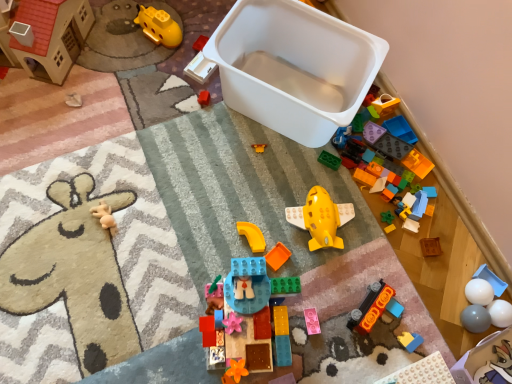
You are a GUI agent. You are given a task and a screenshot of the screen. Output one action in this format:
    pyautogui.click(x=<x>, y=<y>)
    Task: Click on the vacant space that's between matte plastic toy at lower right, the 5th toy viewed from the right, and white plastic tray at upper center, acting as the fourth toy starting from the left
    The image size is (512, 384).
    Given the screenshot: What is the action you would take?
    pyautogui.click(x=284, y=181)